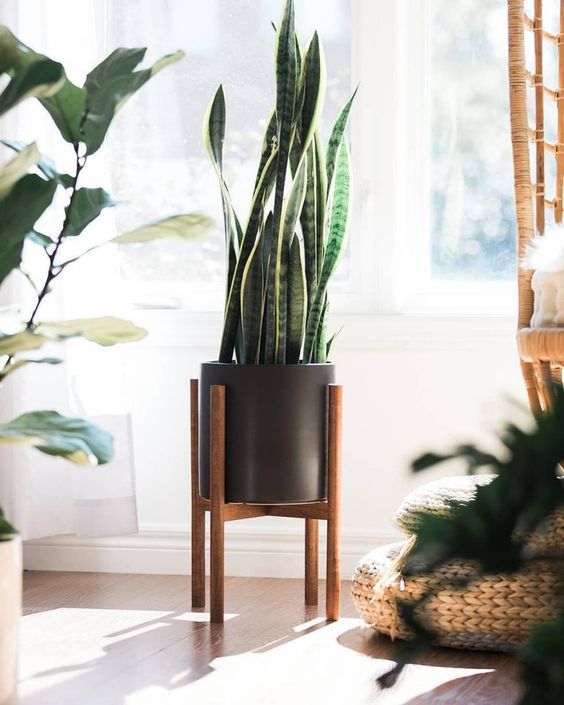
Where is `2 brown cushion`? This screenshot has height=705, width=564. 2 brown cushion is located at coordinates (472, 610), (429, 493).